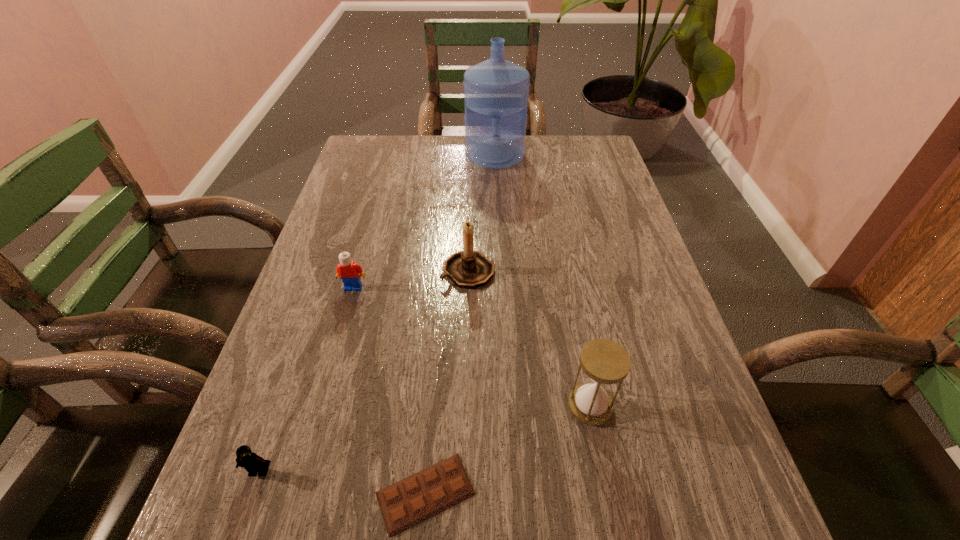
Identify the location of vacant space that satisfies the following two spatial constraints: 1. on the side of the tallest object with the handle; 2. on the left side of the hourglass. This screenshot has height=540, width=960. (507, 406).